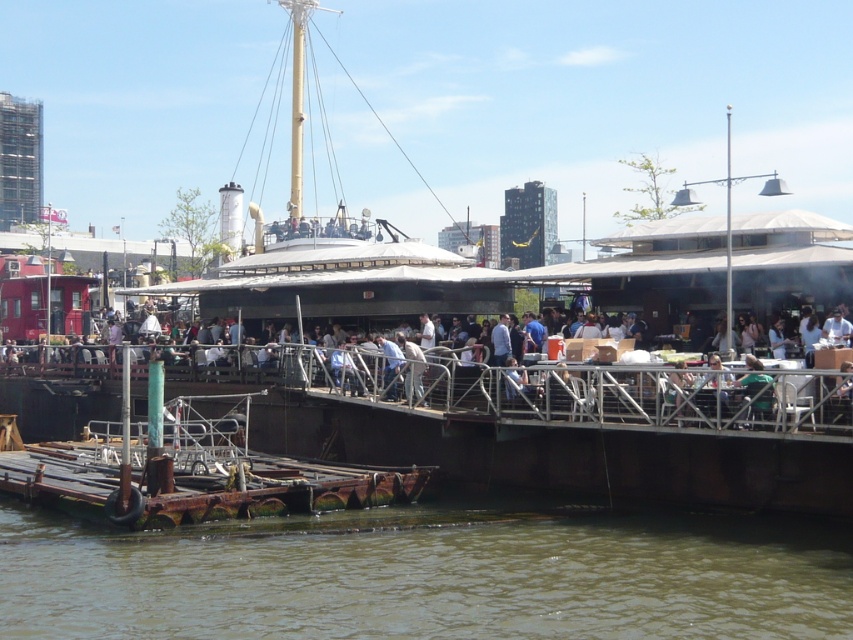
Which is above, brown murky water at lower center or white plastic chair at center?

Positioned higher is white plastic chair at center.

Does brown murky water at lower center appear on the left side of white plastic chair at center?

Incorrect, brown murky water at lower center is not on the left side of white plastic chair at center.

Who is more forward, (x=155, y=605) or (x=787, y=404)?

Point (x=155, y=605) is more forward.

Image resolution: width=853 pixels, height=640 pixels. I want to click on brown murky water at lower center, so click(x=425, y=577).

Can you confirm if brown murky water at lower center is thinner than green fabric chair at center?

No.

Where is `brown murky water at lower center`? brown murky water at lower center is located at coordinates (425, 577).

Can you confirm if white plastic chair at center is positioned to the right of green fabric chair at center?

Incorrect, white plastic chair at center is not on the right side of green fabric chair at center.

Does point (677, 372) lie behind point (746, 385)?

Yes, point (677, 372) is behind point (746, 385).

Locate an element on the screen. The image size is (853, 640). white plastic chair at center is located at coordinates (541, 387).